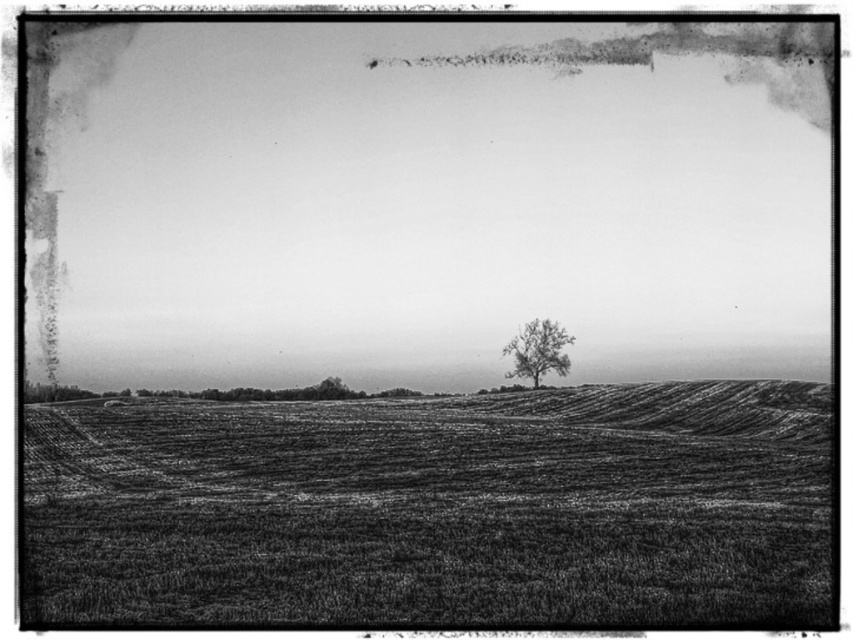
Question: Is smooth soil at center behind bare branch tree at center?

Choices:
 (A) no
 (B) yes

Answer: (B)

Question: Which point is closer to the camera taking this photo?

Choices:
 (A) 795,374
 (B) 531,355

Answer: (B)

Question: Which object is the farthest from the bare branch tree at center?

Choices:
 (A) smooth soil at center
 (B) grainy soil field at center

Answer: (B)

Question: Is smooth soil at center thinner than bare branch tree at center?

Choices:
 (A) yes
 (B) no

Answer: (B)

Question: Is grainy soil field at center wider than smooth soil at center?

Choices:
 (A) yes
 (B) no

Answer: (B)

Question: Which point is farther to the camera?

Choices:
 (A) smooth soil at center
 (B) grainy soil field at center

Answer: (A)